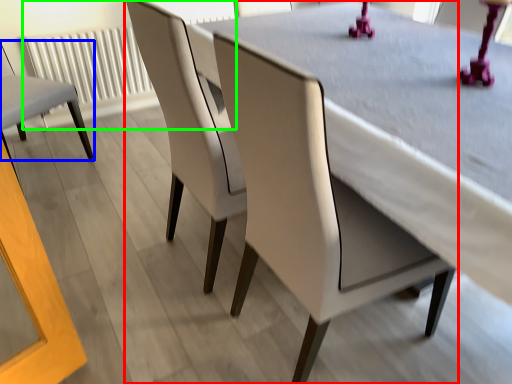
Question: Which is farther away from chair (highlighted by a red box)? chair (highlighted by a blue box) or radiator (highlighted by a green box)?

Choices:
 (A) chair
 (B) radiator

Answer: (B)